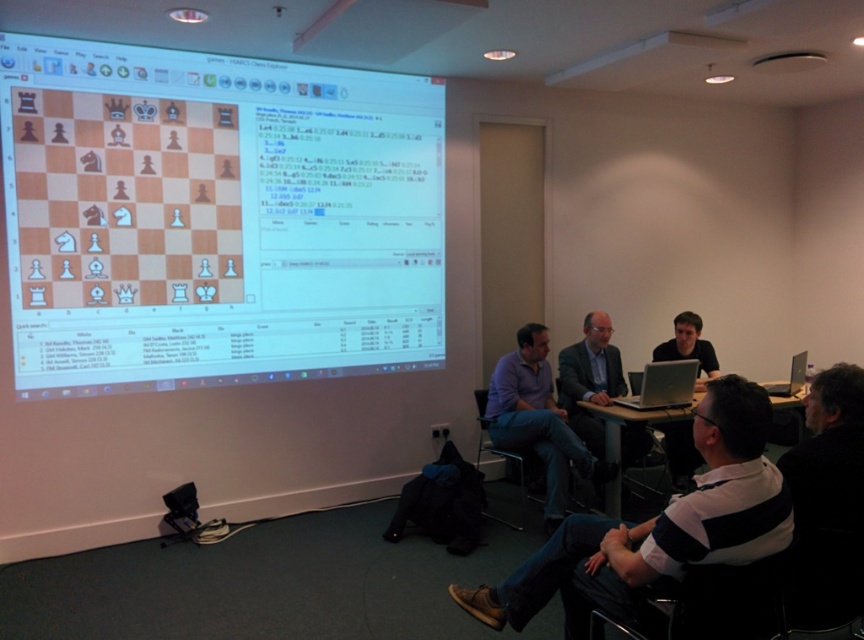
Question: Which of the following is the farthest from the observer?

Choices:
 (A) (786, 392)
 (B) (665, 358)
 (C) (766, 413)

Answer: (B)

Question: Can you confirm if white glossy chessboard at upper left is bigger than purple cotton shirt at center?

Choices:
 (A) no
 (B) yes

Answer: (B)

Question: Which object is closer to the camera taking this photo?

Choices:
 (A) purple cotton shirt at center
 (B) white glossy chessboard at upper left
 (C) silver metallic laptop at center

Answer: (B)

Question: Does white striped shirt at lower right have a smaller size compared to silver metallic laptop at right?

Choices:
 (A) no
 (B) yes

Answer: (A)

Question: Among these points, which one is farthest from the camera?

Choices:
 (A) (739, 492)
 (B) (540, 444)

Answer: (B)

Question: Can you confirm if silver metallic laptop at center is wider than silver metallic laptop at right?

Choices:
 (A) yes
 (B) no

Answer: (B)